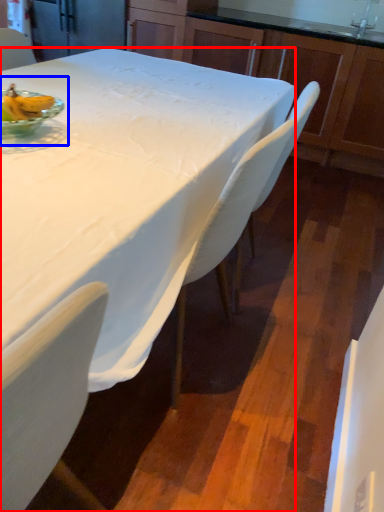
Question: Among these objects, which one is nearest to the camera, desk (highlighted by a red box) or fruit dish (highlighted by a blue box)?

Choices:
 (A) desk
 (B) fruit dish

Answer: (A)